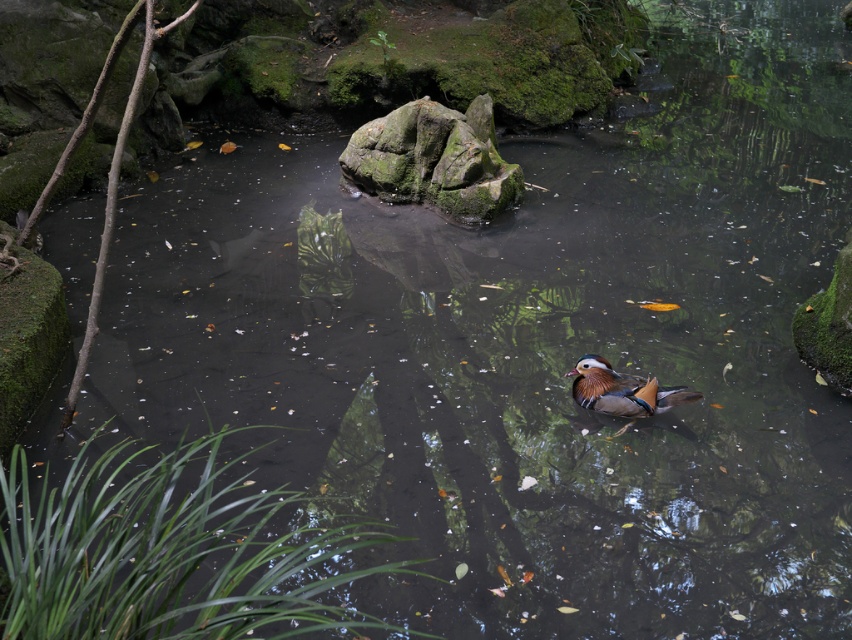
Which is more to the right, green mossy rock at center or shiny orange duck at center?

Positioned to the right is shiny orange duck at center.

How much distance is there between green mossy rock at center and shiny orange duck at center?

2.62 meters

This screenshot has height=640, width=852. Identify the location of green mossy rock at center. (435, 160).

Find the location of a particular element. Image resolution: width=852 pixels, height=640 pixels. green mossy rock at center is located at coordinates (435, 160).